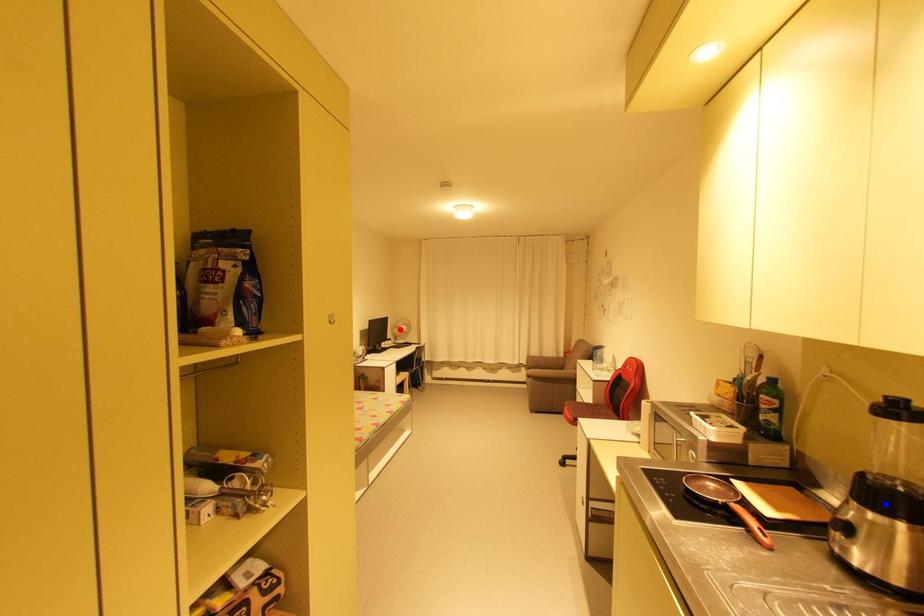
Question: Two points are marked on the image. Which point is closer to the camera?

Choices:
 (A) Blue point is closer.
 (B) Red point is closer.

Answer: (A)